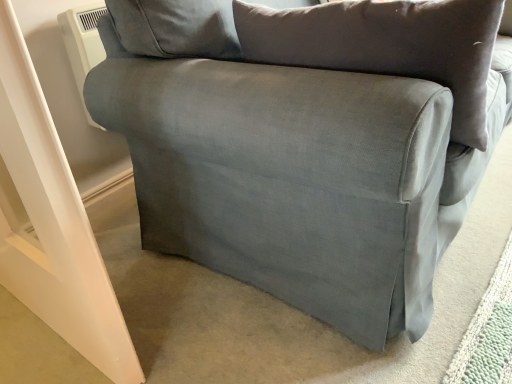
Question: Should I look upward or downward to see suede-like gray pillow at center?

Choices:
 (A) up
 (B) down

Answer: (A)